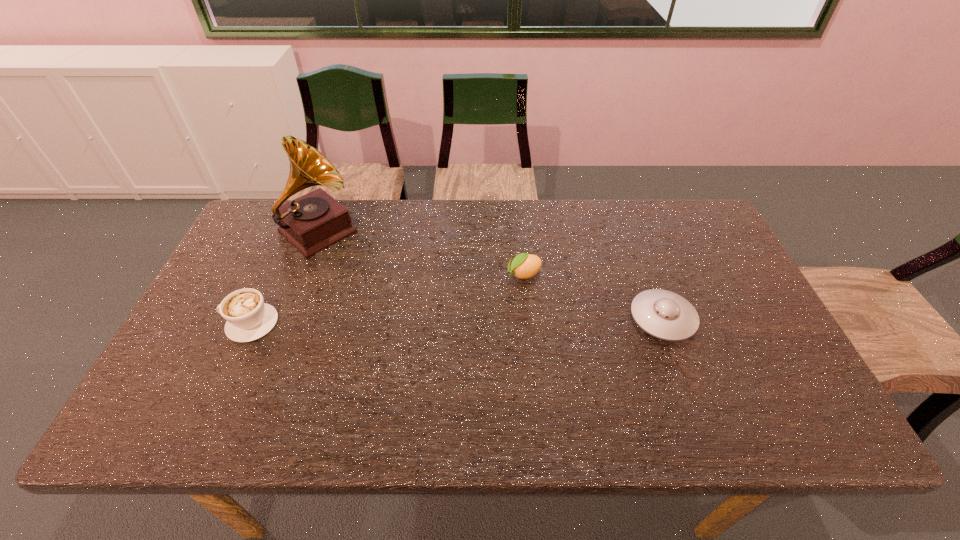
Locate an element on the screen. The width and height of the screenshot is (960, 540). free spot between the cappuccino and the phonograph record is located at coordinates (285, 278).

Where is `empty location between the lemon and the cappuccino`? empty location between the lemon and the cappuccino is located at coordinates (388, 299).

Locate an element on the screen. Image resolution: width=960 pixels, height=540 pixels. unoccupied area between the second farthest object and the shortest object is located at coordinates (593, 296).

The image size is (960, 540). What are the coordinates of `vacant area that lies between the farthest object and the cappuccino` in the screenshot? It's located at (285, 278).

Image resolution: width=960 pixels, height=540 pixels. Find the location of `empty space that is in between the phonograph record and the cappuccino`. empty space that is in between the phonograph record and the cappuccino is located at coordinates [285, 278].

You are a GUI agent. You are given a task and a screenshot of the screen. Output one action in this format:
    pyautogui.click(x=<x>, y=<y>)
    Task: Click on the object that ranks as the third closest to the second object from right to left
    
    Given the screenshot: What is the action you would take?
    pyautogui.click(x=248, y=318)

Select which object is the third closest to the shortest object. Please provide its 2D coordinates. Your answer should be formatted as a tuple, i.e. [(x, y)], where the tuple contains the x and y coordinates of a point satisfying the conditions above.

[(248, 318)]